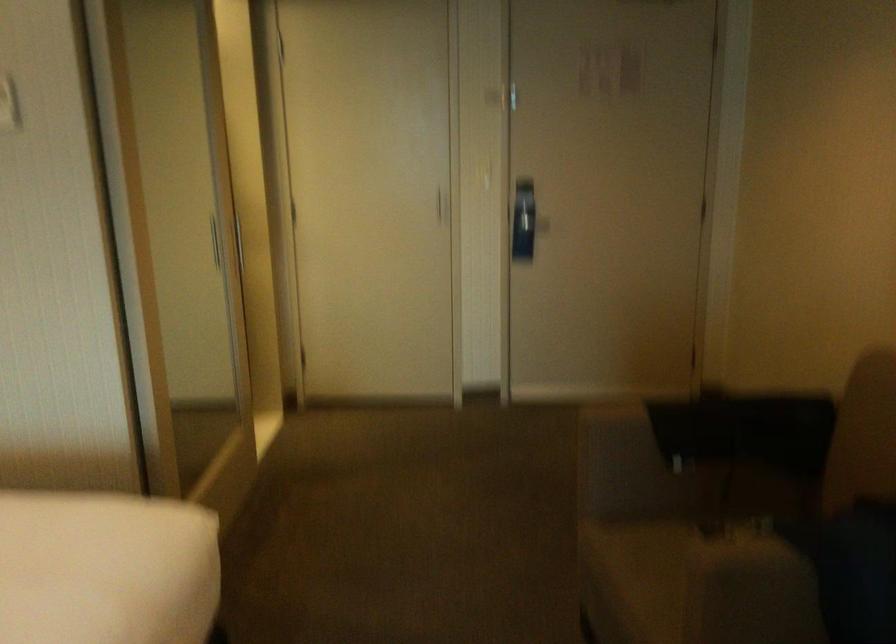
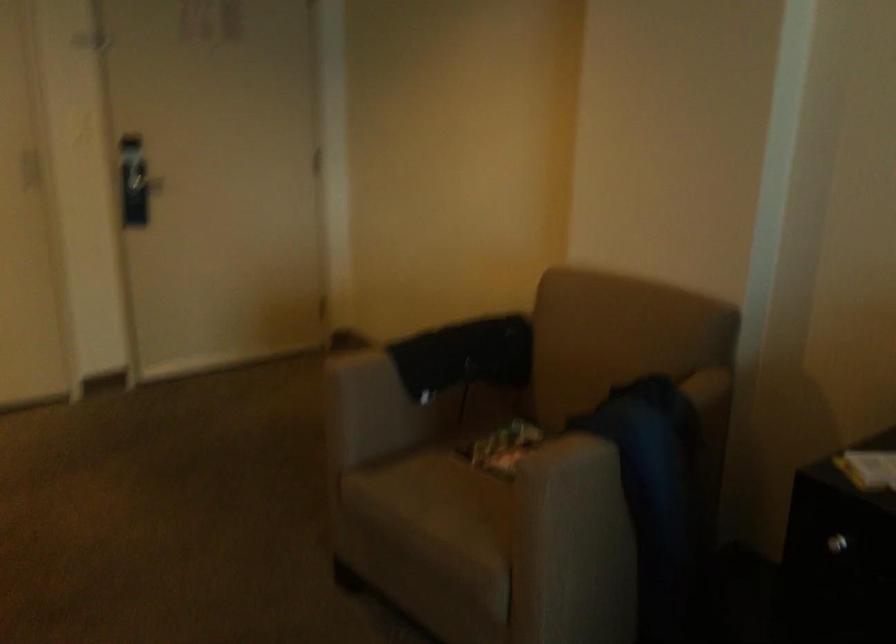
Find the pixel in the second image that matches pixel 667 573 in the first image.

(453, 500)